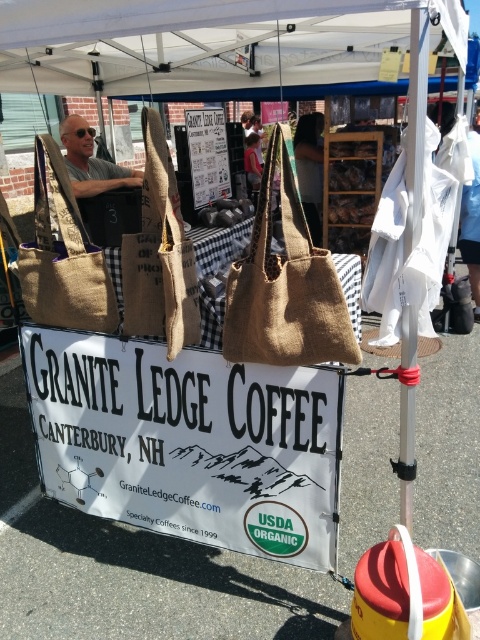
You are a customer at the Granite Ledge Coffee stall. You see the white paper sign at center and the matte gray hair at upper left. Which object is located lower in the image?

The white paper sign at center is located lower than the matte gray hair at upper left.

You are a customer at the Granite Ledge Coffee stall. You notice two items in front of you. One is the white paper sign at center and the other is the matte gray hair at upper left. Which one is taller?

The white paper sign at center is taller than the matte gray hair at upper left.

You are a customer at the Granite Ledge Coffee stall. You notice two items in the scene. The first is a burlap tote at left, and the second is a matte gray hair at upper left. Which of these two items is narrower?

The burlap tote at left has a lesser width compared to matte gray hair at upper left, so the burlap tote at left is narrower.